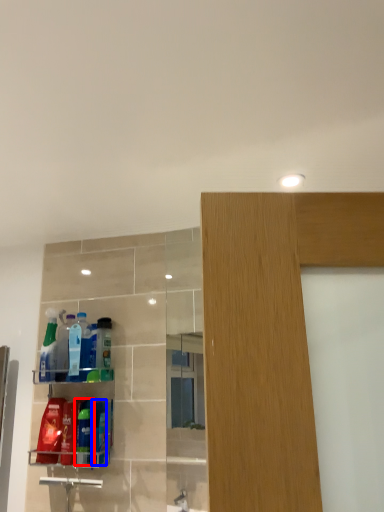
Question: Which object is further to the camera taking this photo, cleaning product (highlighted by a red box) or cleaning product (highlighted by a blue box)?

Choices:
 (A) cleaning product
 (B) cleaning product

Answer: (A)